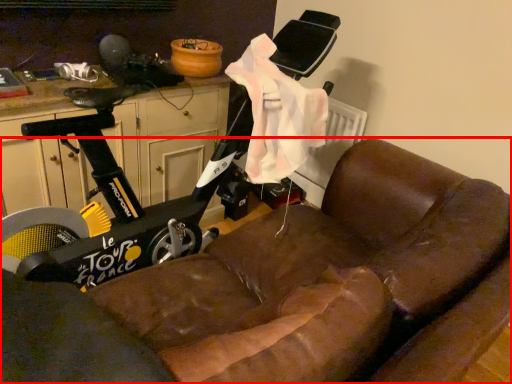
Question: In this image, where is studio couch (annotated by the red box) located relative to dresser?

Choices:
 (A) right
 (B) left

Answer: (A)